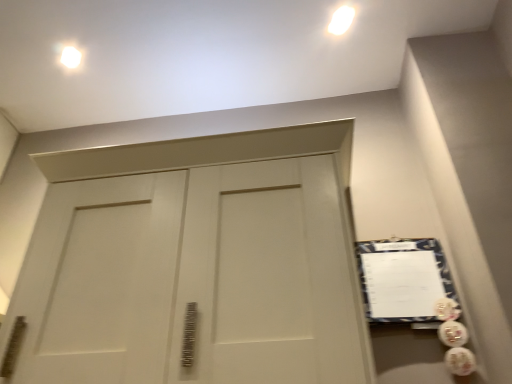
Question: Should I look upward or downward to see white glossy light fixture at upper left?

Choices:
 (A) up
 (B) down

Answer: (A)

Question: Should I look upward or downward to see white fabric bulletin board at right?

Choices:
 (A) up
 (B) down

Answer: (B)

Question: Does white glossy light fixture at upper left appear on the right side of white fabric bulletin board at right?

Choices:
 (A) no
 (B) yes

Answer: (A)

Question: Can you confirm if white glossy light fixture at upper left is smaller than white fabric bulletin board at right?

Choices:
 (A) no
 (B) yes

Answer: (B)

Question: From a real-world perspective, does white glossy light fixture at upper left stand above white fabric bulletin board at right?

Choices:
 (A) no
 (B) yes

Answer: (B)

Question: Could you tell me if white glossy light fixture at upper left is turned towards white fabric bulletin board at right?

Choices:
 (A) no
 (B) yes

Answer: (A)

Question: Considering the relative sizes of white glossy light fixture at upper left and white fabric bulletin board at right in the image provided, is white glossy light fixture at upper left thinner than white fabric bulletin board at right?

Choices:
 (A) no
 (B) yes

Answer: (A)

Question: Is white glossy light fixture at upper left beside white fabric bulletin board at right?

Choices:
 (A) no
 (B) yes

Answer: (A)

Question: Does white fabric bulletin board at right lie behind white glossy light fixture at upper left?

Choices:
 (A) yes
 (B) no

Answer: (B)

Question: Can you confirm if white fabric bulletin board at right is thinner than white glossy light fixture at upper left?

Choices:
 (A) yes
 (B) no

Answer: (A)

Question: Considering the relative sizes of white fabric bulletin board at right and white glossy light fixture at upper left in the image provided, is white fabric bulletin board at right wider than white glossy light fixture at upper left?

Choices:
 (A) yes
 (B) no

Answer: (B)

Question: From the image's perspective, is white fabric bulletin board at right over white glossy light fixture at upper left?

Choices:
 (A) no
 (B) yes

Answer: (A)

Question: From the image's perspective, would you say white fabric bulletin board at right is shown under white glossy light fixture at upper left?

Choices:
 (A) no
 (B) yes

Answer: (B)

Question: Can we say white fabric bulletin board at right lies outside white glossy light fixture at upper left?

Choices:
 (A) no
 (B) yes

Answer: (B)

Question: In terms of width, does white glossy light fixture at upper left look wider or thinner when compared to white fabric bulletin board at right?

Choices:
 (A) thin
 (B) wide

Answer: (B)